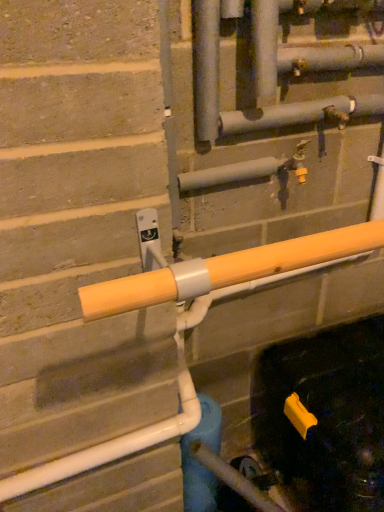
Question: Can you confirm if yellow plastic faucet at center is bigger than yellow matte pipe at center?

Choices:
 (A) yes
 (B) no

Answer: (B)

Question: Is yellow plastic faucet at center turned away from yellow matte pipe at center?

Choices:
 (A) yes
 (B) no

Answer: (B)

Question: Is yellow plastic faucet at center located outside yellow matte pipe at center?

Choices:
 (A) no
 (B) yes

Answer: (B)

Question: Is yellow plastic faucet at center in front of yellow matte pipe at center?

Choices:
 (A) yes
 (B) no

Answer: (B)

Question: Is yellow plastic faucet at center aimed at yellow matte pipe at center?

Choices:
 (A) no
 (B) yes

Answer: (B)

Question: Considering the positions of blue matte water pipe at center and yellow plastic faucet at center in the image, is blue matte water pipe at center wider or thinner than yellow plastic faucet at center?

Choices:
 (A) wide
 (B) thin

Answer: (A)

Question: Looking at the image, does blue matte water pipe at center seem bigger or smaller compared to yellow plastic faucet at center?

Choices:
 (A) big
 (B) small

Answer: (A)

Question: Would you say blue matte water pipe at center is to the left or to the right of yellow plastic faucet at center in the picture?

Choices:
 (A) left
 (B) right

Answer: (A)

Question: Do you think blue matte water pipe at center is within yellow plastic faucet at center, or outside of it?

Choices:
 (A) inside
 (B) outside

Answer: (B)

Question: Looking at their shapes, would you say yellow plastic faucet at center is wider or thinner than yellow matte pipe at center?

Choices:
 (A) wide
 (B) thin

Answer: (B)

Question: Looking at the image, does yellow plastic faucet at center seem bigger or smaller compared to yellow matte pipe at center?

Choices:
 (A) big
 (B) small

Answer: (B)

Question: Would you say yellow plastic faucet at center is to the left or to the right of yellow matte pipe at center in the picture?

Choices:
 (A) left
 (B) right

Answer: (B)

Question: From the image's perspective, is yellow plastic faucet at center above or below yellow matte pipe at center?

Choices:
 (A) below
 (B) above

Answer: (B)

Question: Is yellow plastic faucet at center inside the boundaries of blue matte water pipe at center, or outside?

Choices:
 (A) inside
 (B) outside

Answer: (B)

Question: Is yellow plastic faucet at center in front of or behind blue matte water pipe at center in the image?

Choices:
 (A) front
 (B) behind

Answer: (A)